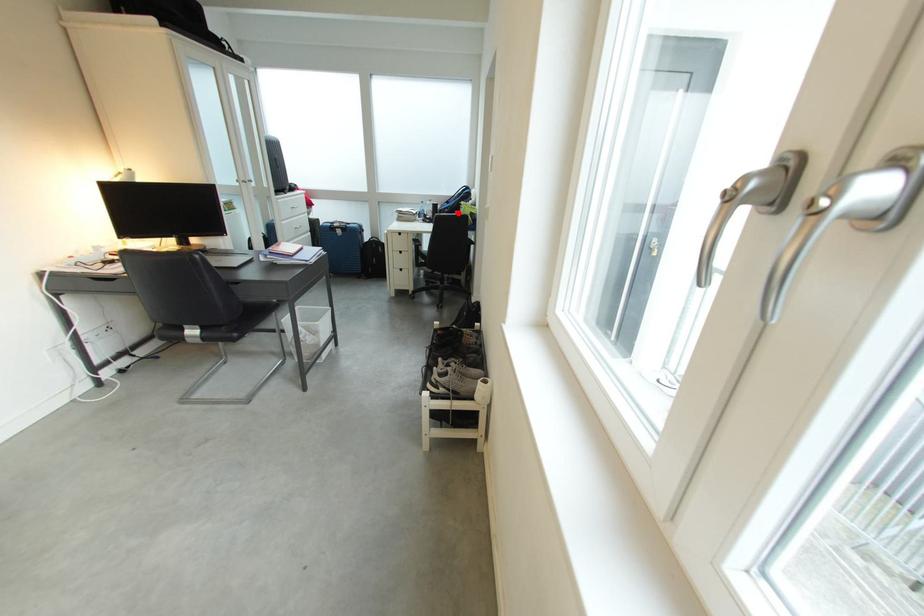
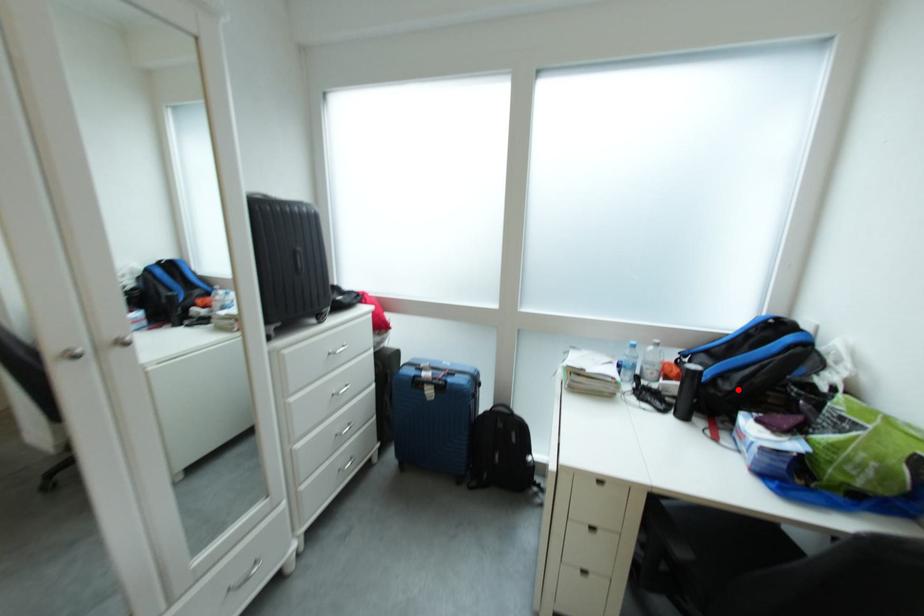
I am providing you with two images of the same scene from different viewpoints. A red point is marked on the first image and another point is marked on the second image. Do the highlighted points in image1 and image2 indicate the same real-world spot?

Yes